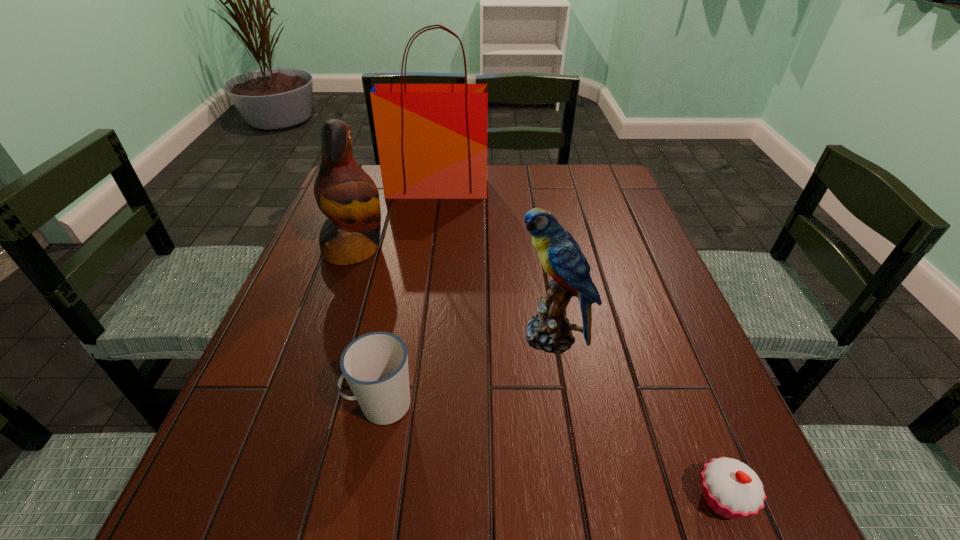
This screenshot has width=960, height=540. I want to click on shopping bag at the left edge, so click(432, 138).

Where is `parrot situated at the left edge`? parrot situated at the left edge is located at coordinates (348, 197).

Find the location of a particular element. The width and height of the screenshot is (960, 540). object at the right edge is located at coordinates (732, 489).

Where is `object present at the far left corner`? The width and height of the screenshot is (960, 540). object present at the far left corner is located at coordinates (432, 138).

Find the location of `object that is positioned at the near right corner`. object that is positioned at the near right corner is located at coordinates (732, 489).

This screenshot has height=540, width=960. In the image, there is a desktop. What are the coordinates of `blank space at the far edge` in the screenshot? It's located at (562, 182).

Locate an element on the screen. This screenshot has height=540, width=960. vacant space at the left edge of the desktop is located at coordinates (330, 285).

The width and height of the screenshot is (960, 540). I want to click on vacant space at the right edge of the desktop, so click(619, 305).

I want to click on free region at the far left corner of the desktop, so click(x=378, y=179).

The image size is (960, 540). I want to click on free spot between the third farthest object and the shopping bag, so click(494, 262).